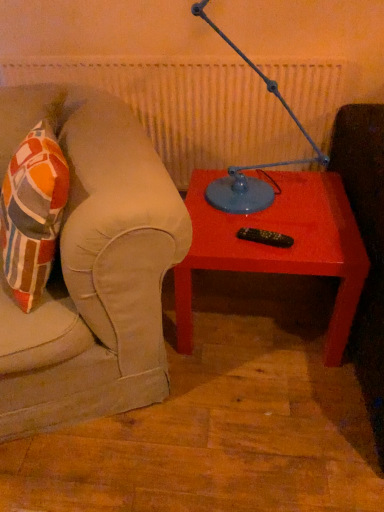
Question: Can you confirm if matte red table at center is positioned to the left of blue metallic table lamp at upper center?

Choices:
 (A) no
 (B) yes

Answer: (A)

Question: Can you confirm if matte red table at center is smaller than blue metallic table lamp at upper center?

Choices:
 (A) yes
 (B) no

Answer: (B)

Question: Is matte red table at center to the right of blue metallic table lamp at upper center from the viewer's perspective?

Choices:
 (A) no
 (B) yes

Answer: (B)

Question: Would you say matte red table at center contains blue metallic table lamp at upper center?

Choices:
 (A) yes
 (B) no

Answer: (B)

Question: Is matte red table at center oriented towards blue metallic table lamp at upper center?

Choices:
 (A) no
 (B) yes

Answer: (A)

Question: Is matte red table at center positioned before blue metallic table lamp at upper center?

Choices:
 (A) yes
 (B) no

Answer: (B)

Question: Is blue metallic table lamp at upper center taller than matte red table at center?

Choices:
 (A) yes
 (B) no

Answer: (A)

Question: Is the position of blue metallic table lamp at upper center more distant than that of matte red table at center?

Choices:
 (A) yes
 (B) no

Answer: (B)

Question: From a real-world perspective, is blue metallic table lamp at upper center positioned under matte red table at center based on gravity?

Choices:
 (A) no
 (B) yes

Answer: (A)

Question: Is blue metallic table lamp at upper center outside of matte red table at center?

Choices:
 (A) no
 (B) yes

Answer: (B)

Question: Does blue metallic table lamp at upper center have a lesser height compared to matte red table at center?

Choices:
 (A) no
 (B) yes

Answer: (A)

Question: Can you confirm if blue metallic table lamp at upper center is smaller than matte red table at center?

Choices:
 (A) no
 (B) yes

Answer: (B)

Question: In terms of size, does matte red table at center appear bigger or smaller than blue metallic table lamp at upper center?

Choices:
 (A) small
 (B) big

Answer: (B)